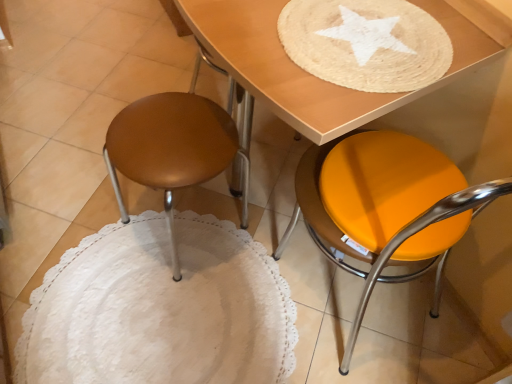
The image size is (512, 384). In order to click on vacant space underneath matte brown stool at left (from a real-world perspective) in this screenshot , I will do `click(179, 235)`.